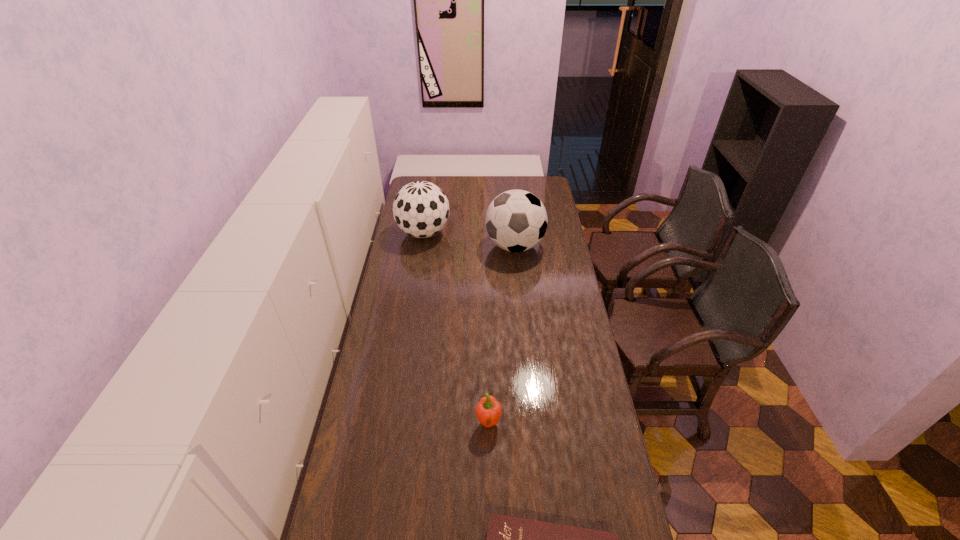
In order to click on the right soccer ball in this screenshot , I will do `click(516, 220)`.

This screenshot has width=960, height=540. I want to click on the leftmost object, so click(421, 209).

You are a GUI agent. You are given a task and a screenshot of the screen. Output one action in this format:
    pyautogui.click(x=<x>, y=<y>)
    Task: Click on the third tallest object
    The width and height of the screenshot is (960, 540).
    Given the screenshot: What is the action you would take?
    pyautogui.click(x=488, y=411)

Where is `pepper`? The image size is (960, 540). pepper is located at coordinates (488, 411).

Where is `vacant space situated on the main logo of the right soccer ball`? vacant space situated on the main logo of the right soccer ball is located at coordinates (407, 246).

What are the coordinates of `vacant space located 0.190m on the main logo of the right soccer ball` in the screenshot? It's located at (447, 246).

The height and width of the screenshot is (540, 960). I want to click on vacant region located 0.190m on the main logo of the right soccer ball, so click(x=447, y=246).

At what (x,y) coordinates should I click in order to perform the action: click on free space located 0.280m on the front of the left soccer ball. Please return your answer as a coordinate pair (x, y). Image resolution: width=960 pixels, height=540 pixels. Looking at the image, I should click on point(415,288).

Locate an element on the screen. The height and width of the screenshot is (540, 960). vacant space located 0.290m on the left of the third tallest object is located at coordinates (390, 422).

I want to click on object that is positioned at the left edge, so click(x=421, y=209).